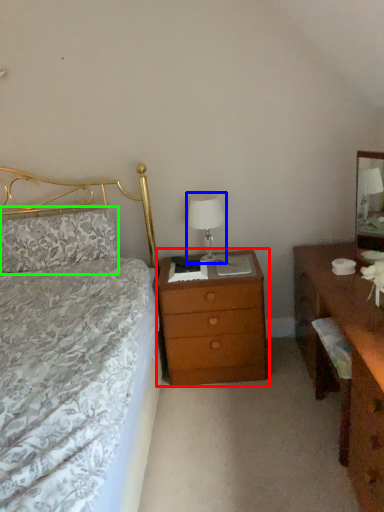
Question: Considering the real-world distances, which object is closest to nightstand (highlighted by a red box)? bedside lamp (highlighted by a blue box) or pillow (highlighted by a green box).

Choices:
 (A) bedside lamp
 (B) pillow

Answer: (A)